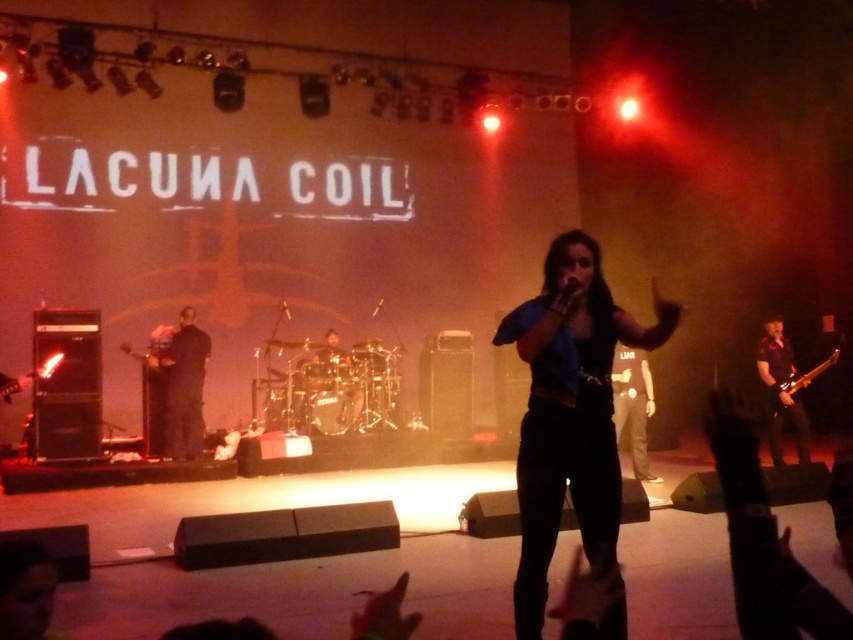
Question: Which point is closer to the camera?

Choices:
 (A) (776, 385)
 (B) (782, 413)

Answer: (A)

Question: Can you confirm if black matte jacket at left is thinner than shiny metallic guitar at right?

Choices:
 (A) no
 (B) yes

Answer: (B)

Question: Can you confirm if black matte jacket at left is positioned to the right of shiny metallic guitar at right?

Choices:
 (A) yes
 (B) no

Answer: (B)

Question: Which point appears closest to the camera in this image?

Choices:
 (A) (619, 401)
 (B) (520, 333)
 (C) (786, 372)

Answer: (B)

Question: Estimate the real-world distances between objects in this image. Which object is farther from the black cotton pants at center?

Choices:
 (A) shiny metallic guitar at right
 (B) shiny black guitar at right
 (C) blue fabric shirt at center

Answer: (C)

Question: Is blue fabric shirt at center to the right of shiny metallic guitar at right from the viewer's perspective?

Choices:
 (A) yes
 (B) no

Answer: (B)